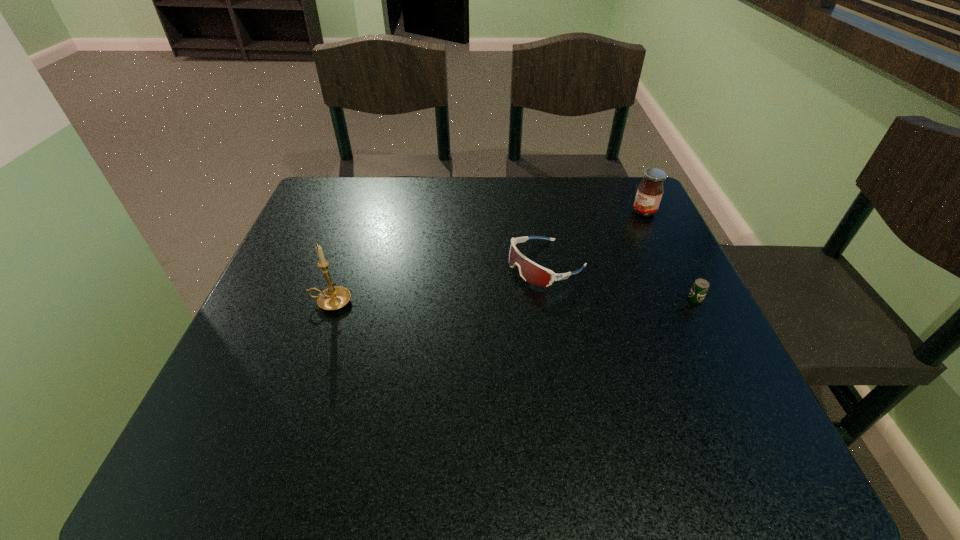
This screenshot has width=960, height=540. In order to click on vacant space located 0.080m on the front-facing side of the third object from right to left in this screenshot , I will do `click(485, 293)`.

This screenshot has height=540, width=960. Identify the location of vacant space located 0.180m on the label side of the farthest object. (591, 246).

In order to click on vacant region located 0.230m on the label side of the farthest object in this screenshot , I will do `click(578, 255)`.

This screenshot has width=960, height=540. What are the coordinates of `free spot located 0.100m on the label side of the farthest object` in the screenshot? It's located at (612, 232).

Locate an element on the screen. Image resolution: width=960 pixels, height=540 pixels. object present at the far edge is located at coordinates (649, 193).

At what (x,y) coordinates should I click in order to perform the action: click on object that is at the left edge. Please return your answer as a coordinate pair (x, y). Looking at the image, I should click on (333, 298).

Where is `beer can present at the right edge`? The image size is (960, 540). beer can present at the right edge is located at coordinates (700, 287).

Where is `jam that is at the right edge`? jam that is at the right edge is located at coordinates (649, 193).

Locate an element on the screen. The width and height of the screenshot is (960, 540). object situated at the far right corner is located at coordinates (649, 193).

Image resolution: width=960 pixels, height=540 pixels. I want to click on free location at the far edge of the desktop, so click(x=410, y=191).